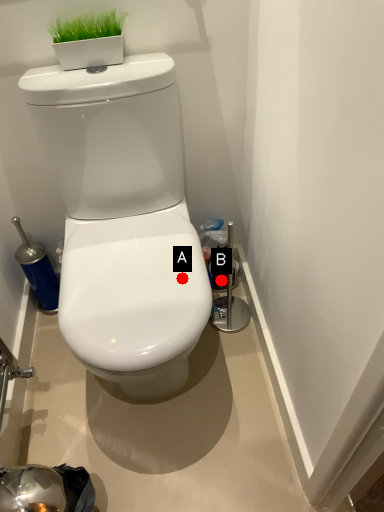
Question: Two points are circled on the image, labeled by A and B beside each circle. Which of the following is the farthest from the observer?

Choices:
 (A) A is further
 (B) B is further

Answer: (B)